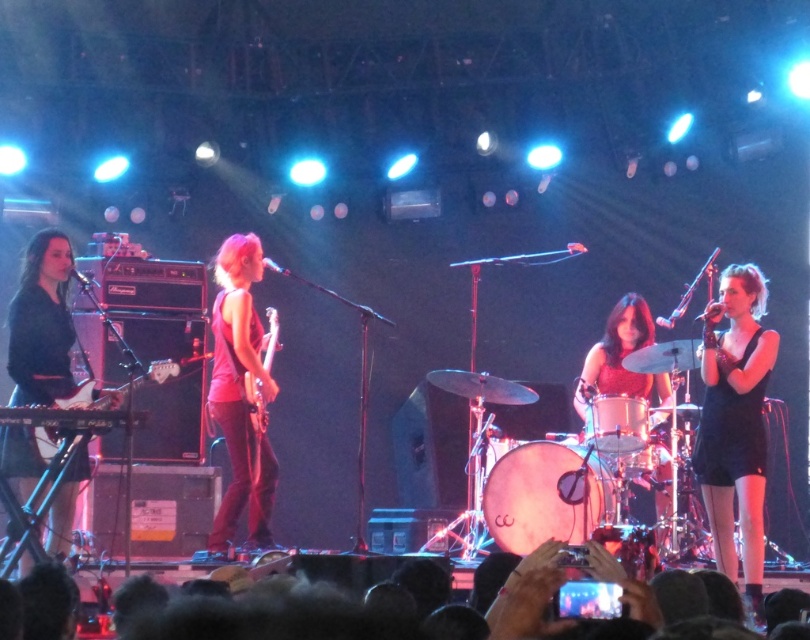
Which is in front, point (512, 573) or point (261, 336)?

Point (512, 573) is more forward.

Where is `black fabric crowd at lower center`? black fabric crowd at lower center is located at coordinates (531, 598).

Where is `black fabric crowd at lower center`? The image size is (810, 640). black fabric crowd at lower center is located at coordinates (531, 598).

The height and width of the screenshot is (640, 810). Identify the location of black fabric crowd at lower center. (531, 598).

Looking at this image, is black matte dress at right wider than smooth black drum at center?

Correct, the width of black matte dress at right exceeds that of smooth black drum at center.

Is point (749, 588) farther from camera compared to point (655, 474)?

No.

In the scene shown: Measure the distance between point [721,538] and camera.

They are 6.14 meters apart.

Where is `black matte dress at right`? The image size is (810, 640). black matte dress at right is located at coordinates (735, 426).

Does black fabric crowd at lower center have a lesser height compared to glossy wood guitar at center?

Correct, black fabric crowd at lower center is not as tall as glossy wood guitar at center.

Between black fabric crowd at lower center and glossy wood guitar at center, which one appears on the right side from the viewer's perspective?

From the viewer's perspective, black fabric crowd at lower center appears more on the right side.

The image size is (810, 640). Describe the element at coordinates (531, 598) in the screenshot. I see `black fabric crowd at lower center` at that location.

Image resolution: width=810 pixels, height=640 pixels. Find the location of `black fabric crowd at lower center`. black fabric crowd at lower center is located at coordinates (531, 598).